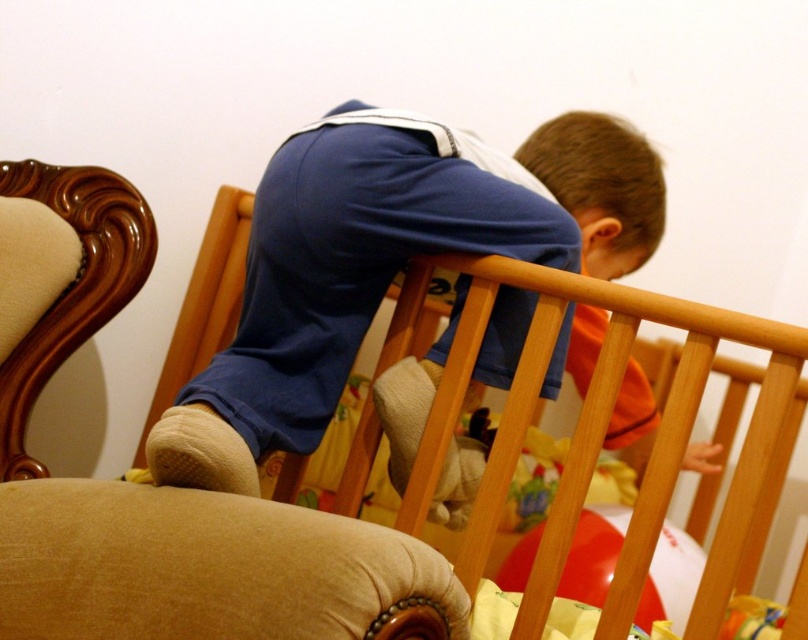
Does blue cotton shirt at center have a greater width compared to wooden crib at upper center?

Indeed, blue cotton shirt at center has a greater width compared to wooden crib at upper center.

Does blue cotton shirt at center appear under wooden crib at upper center?

Actually, blue cotton shirt at center is above wooden crib at upper center.

The image size is (808, 640). Identify the location of blue cotton shirt at center. (389, 260).

Is point (445, 243) positioned in front of point (396, 557)?

No.

Which is behind, point (348, 280) or point (6, 529)?

The point (348, 280) is behind.

I want to click on blue cotton shirt at center, so click(x=389, y=260).

Does beige fabric armchair at left appear over wooden crib at upper center?

Indeed, beige fabric armchair at left is positioned over wooden crib at upper center.

Between beige fabric armchair at left and wooden crib at upper center, which one appears on the left side from the viewer's perspective?

beige fabric armchair at left is more to the left.

The height and width of the screenshot is (640, 808). What are the coordinates of `beige fabric armchair at left` in the screenshot? It's located at (161, 490).

The width and height of the screenshot is (808, 640). In order to click on beige fabric armchair at left in this screenshot , I will do `click(161, 490)`.